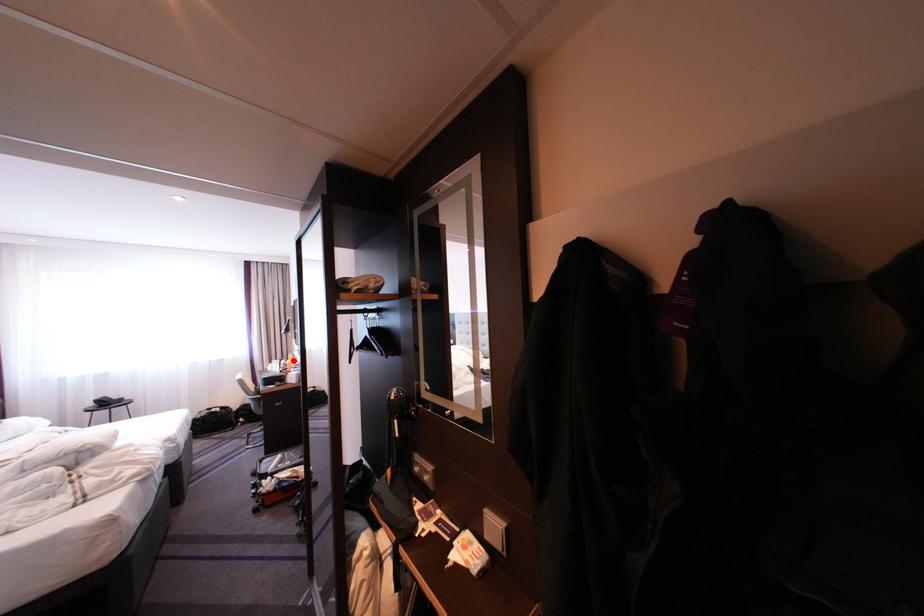
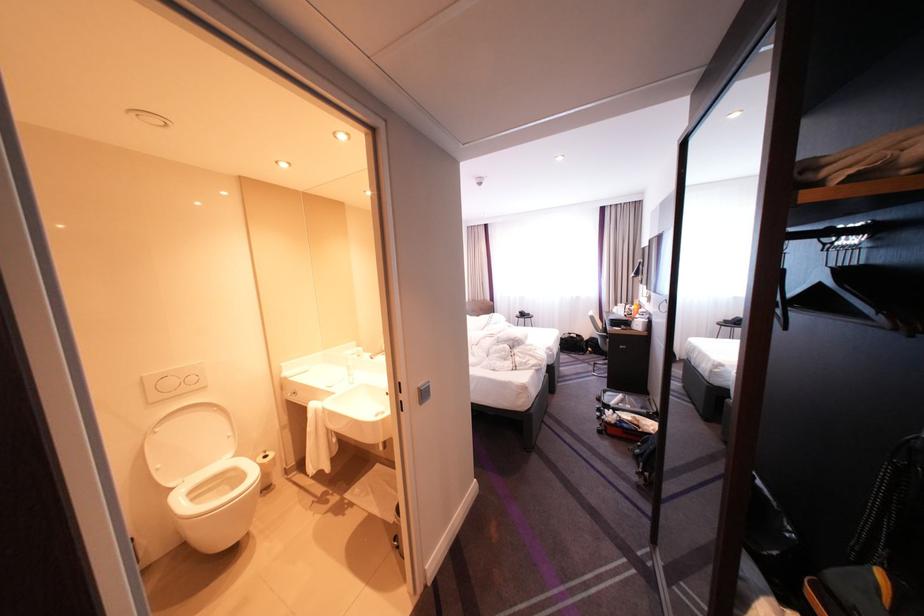
Question: I am providing you with two images of the same scene from different viewpoints. A red point is shown in image1. For the corresponding object point in image2, is it positioned nearer or farther from the camera?

Choices:
 (A) Nearer
 (B) Farther

Answer: (A)